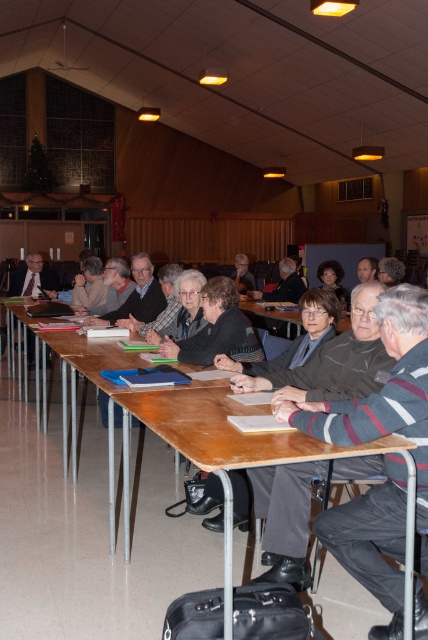
Question: Which point is closer to the camera?

Choices:
 (A) (345, 522)
 (B) (202, 467)
 (C) (146, 284)

Answer: (B)

Question: Is striped sweater at center closer to the viewer compared to brown wooden table at center?

Choices:
 (A) yes
 (B) no

Answer: (B)

Question: Does striped sweater at center have a smaller size compared to brown wooden table at center?

Choices:
 (A) no
 (B) yes

Answer: (B)

Question: Is wooden table at center wider than dark gray sweater at center?

Choices:
 (A) yes
 (B) no

Answer: (A)

Question: Among these objects, which one is farthest from the camera?

Choices:
 (A) brown wooden table at center
 (B) dark gray sweater at center
 (C) wooden table at center
 (D) matte black suit at left

Answer: (D)

Question: Among these objects, which one is nearest to the camera?

Choices:
 (A) wooden table at center
 (B) striped sweater at center

Answer: (A)